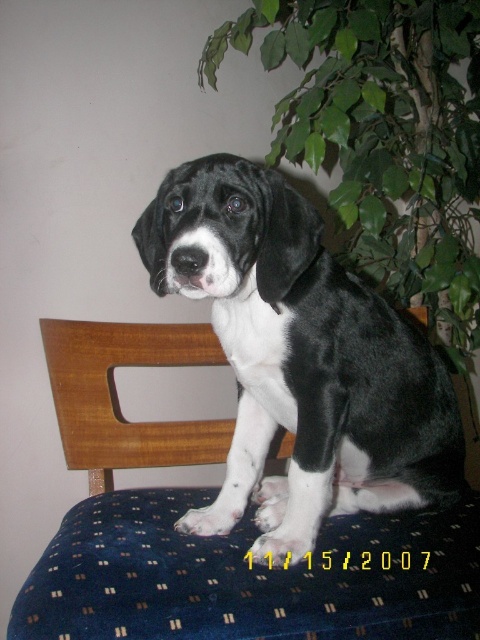
Which of these two, wooden chair at center or black/white fur dog at center, stands shorter?

wooden chair at center is shorter.

Who is taller, wooden chair at center or black/white fur dog at center?

black/white fur dog at center

Which is in front, point (425, 541) or point (301, 301)?

Point (301, 301) is more forward.

The width and height of the screenshot is (480, 640). I want to click on wooden chair at center, so click(216, 538).

Is black/white fur dog at center further to camera compared to green leafy plant at upper right?

No, it is not.

Which is behind, point (147, 209) or point (344, 132)?

Point (344, 132)

You are a GUI agent. You are given a task and a screenshot of the screen. Output one action in this format:
    pyautogui.click(x=<x>, y=<y>)
    Task: Click on the black/white fur dog at center
    
    Given the screenshot: What is the action you would take?
    pyautogui.click(x=300, y=358)

Is wooden chair at center to the left of green leafy plant at upper right from the viewer's perspective?

Correct, you'll find wooden chair at center to the left of green leafy plant at upper right.

What are the coordinates of `wooden chair at center` in the screenshot? It's located at (216, 538).

The height and width of the screenshot is (640, 480). What are the coordinates of `wooden chair at center` in the screenshot? It's located at pyautogui.click(x=216, y=538).